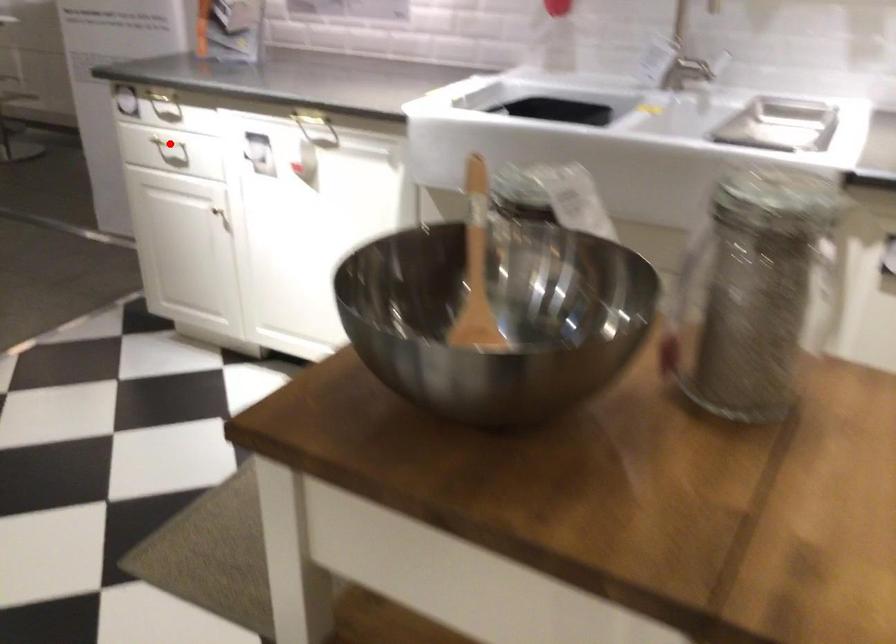
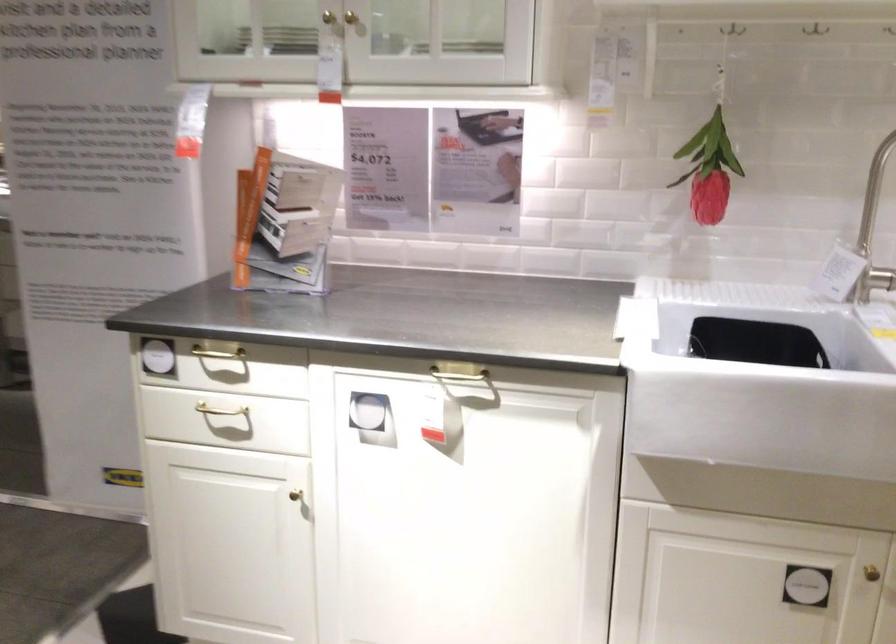
Find the pixel in the second image that matches the highlighted location in the first image.

(220, 410)